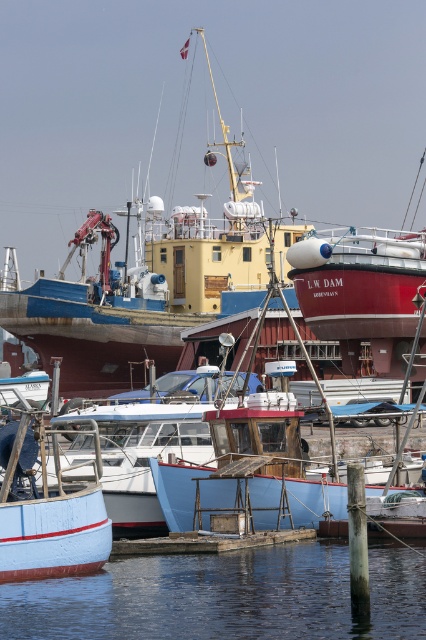
Is yellow matte ship at center bigger than transparent water at lower center?

Yes.

I want to click on yellow matte ship at center, so click(x=144, y=285).

What are the coordinates of `yellow matte ship at center` in the screenshot? It's located at (144, 285).